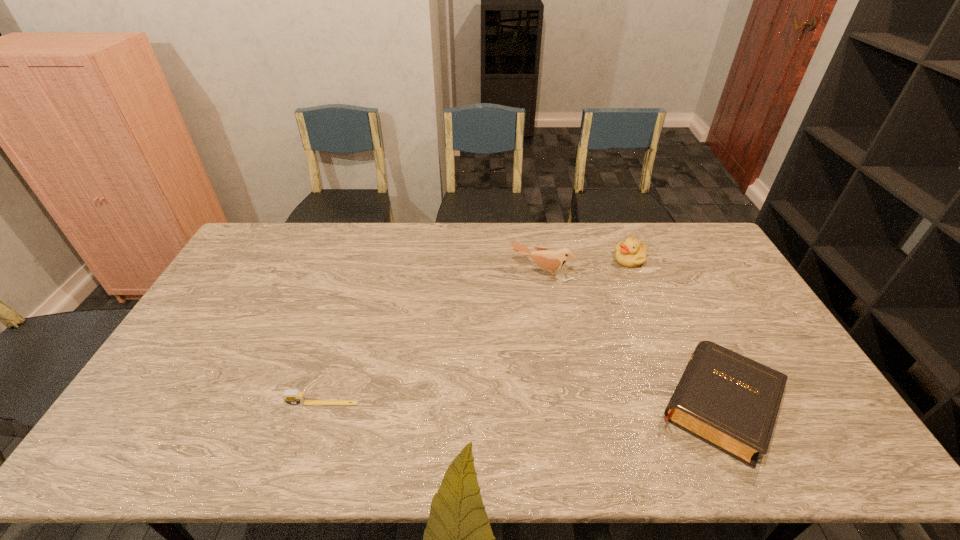
Locate an element on the screen. The width and height of the screenshot is (960, 540). vacant spot on the desktop that is between the tape measure and the third tallest object and is positioned at the beak of the second object from left to right is located at coordinates (485, 404).

Where is `vacant space on the desktop that is between the tape measure and the Bible and is positioned on the front-facing side of the duckling`? This screenshot has height=540, width=960. vacant space on the desktop that is between the tape measure and the Bible and is positioned on the front-facing side of the duckling is located at coordinates (514, 404).